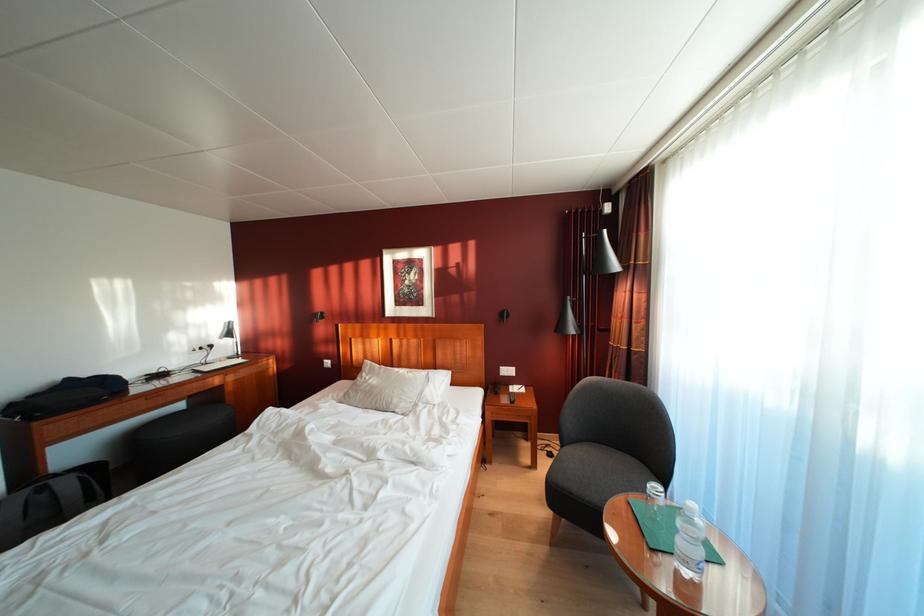
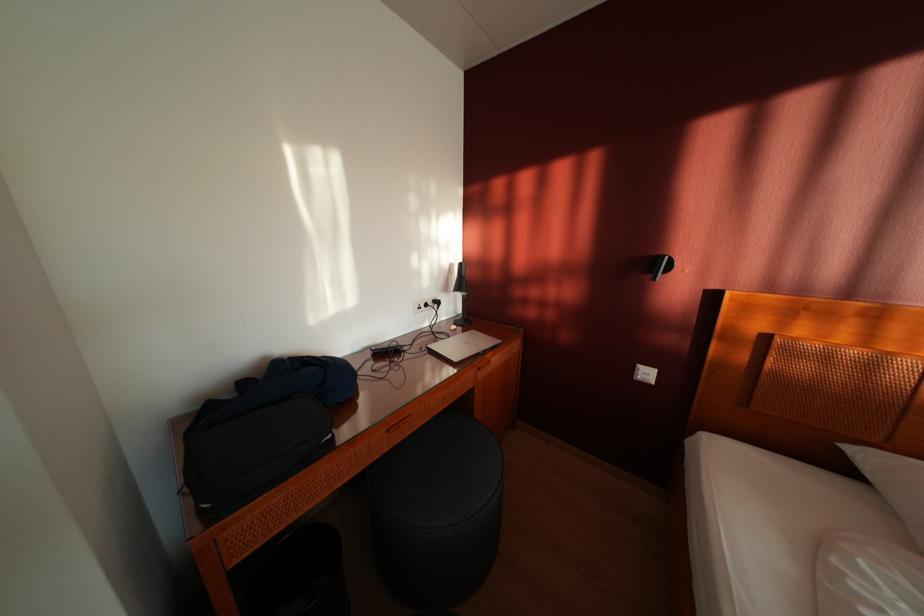
What movement of the cameraman would produce the second image?

The cameraman moved toward left, forward.